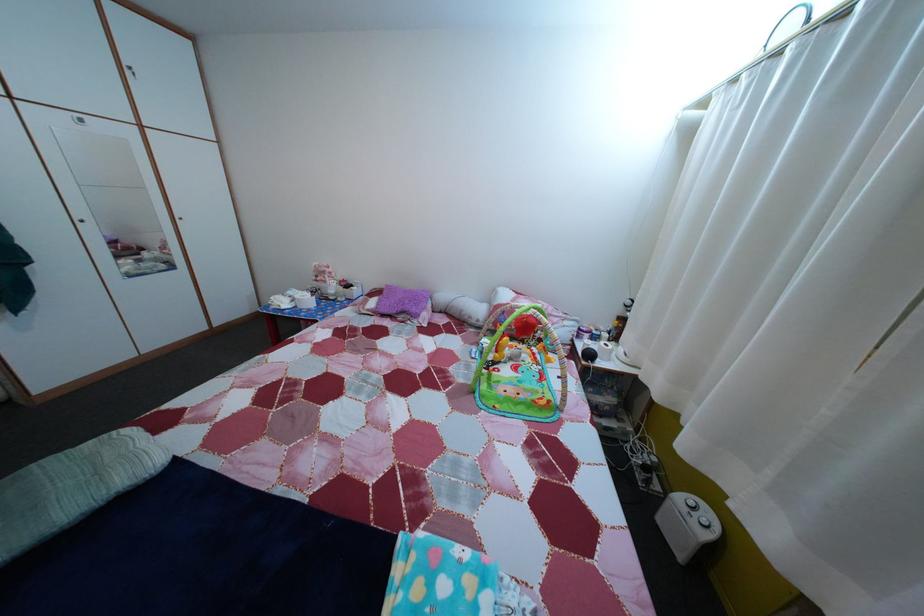
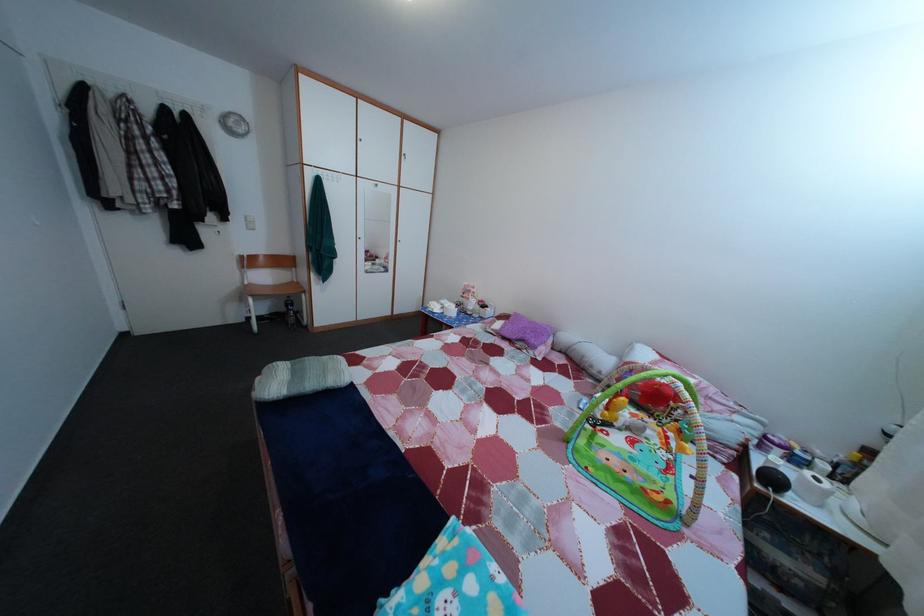
Question: How did the camera likely rotate?

Choices:
 (A) Left
 (B) Right
 (C) Up
 (D) Down

Answer: (A)